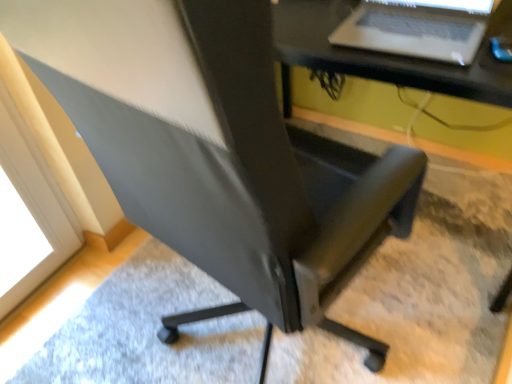
The width and height of the screenshot is (512, 384). Identify the location of silver metallic laptop at upper right. (417, 28).

Describe the element at coordinates (417, 28) in the screenshot. This screenshot has height=384, width=512. I see `silver metallic laptop at upper right` at that location.

Identify the location of black plastic computer desk at center. The image size is (512, 384). (366, 57).

Image resolution: width=512 pixels, height=384 pixels. Describe the element at coordinates (366, 57) in the screenshot. I see `black plastic computer desk at center` at that location.

At what (x,y) coordinates should I click in order to perform the action: click on silver metallic laptop at upper right. Please return your answer as a coordinate pair (x, y). Looking at the image, I should click on 417,28.

Can you confirm if silver metallic laptop at upper right is positioned to the left of black plastic computer desk at center?

Correct, you'll find silver metallic laptop at upper right to the left of black plastic computer desk at center.

Considering the relative positions of silver metallic laptop at upper right and black plastic computer desk at center in the image provided, is silver metallic laptop at upper right in front of black plastic computer desk at center?

No.

Considering the points (354, 19) and (293, 35), which point is in front, point (354, 19) or point (293, 35)?

The point (293, 35) is more forward.

From the image's perspective, who appears lower, silver metallic laptop at upper right or black plastic computer desk at center?

black plastic computer desk at center, from the image's perspective.

From a real-world perspective, which object stands above the other?

silver metallic laptop at upper right, from a real-world perspective.

Considering the relative sizes of silver metallic laptop at upper right and black plastic computer desk at center in the image provided, is silver metallic laptop at upper right wider than black plastic computer desk at center?

No, silver metallic laptop at upper right is not wider than black plastic computer desk at center.

Considering the sizes of objects silver metallic laptop at upper right and black plastic computer desk at center in the image provided, who is shorter, silver metallic laptop at upper right or black plastic computer desk at center?

Standing shorter between the two is silver metallic laptop at upper right.

Is silver metallic laptop at upper right smaller than black plastic computer desk at center?

Correct, silver metallic laptop at upper right occupies less space than black plastic computer desk at center.

Looking at this image, is silver metallic laptop at upper right inside or outside of black plastic computer desk at center?

silver metallic laptop at upper right is inside black plastic computer desk at center.

Are silver metallic laptop at upper right and black plastic computer desk at center beside each other?

They are not placed beside each other.

Looking at this image, is silver metallic laptop at upper right oriented towards black plastic computer desk at center?

No, silver metallic laptop at upper right is not oriented towards black plastic computer desk at center.

Can you tell me how much silver metallic laptop at upper right and black plastic computer desk at center differ in facing direction?

The angle between the facing direction of silver metallic laptop at upper right and the facing direction of black plastic computer desk at center is 2.52 degrees.

This screenshot has width=512, height=384. Find the location of `laptop above the black plastic computer desk at center (from the image's perspective)`. laptop above the black plastic computer desk at center (from the image's perspective) is located at coordinates (417, 28).

Between black plastic computer desk at center and silver metallic laptop at upper right, which one appears on the right side from the viewer's perspective?

From the viewer's perspective, black plastic computer desk at center appears more on the right side.

Which object is closer to the camera taking this photo, black plastic computer desk at center or silver metallic laptop at upper right?

black plastic computer desk at center.

Which is more distant, (445, 78) or (435, 50)?

The point (435, 50) is farther from the camera.

From the image's perspective, is black plastic computer desk at center located above silver metallic laptop at upper right?

Actually, black plastic computer desk at center appears below silver metallic laptop at upper right in the image.

From a real-world perspective, which object stands above the other?

silver metallic laptop at upper right.

Does black plastic computer desk at center have a lesser width compared to silver metallic laptop at upper right?

No.

In terms of height, does black plastic computer desk at center look taller or shorter compared to silver metallic laptop at upper right?

In the image, black plastic computer desk at center appears to be taller than silver metallic laptop at upper right.

Is black plastic computer desk at center bigger than silver metallic laptop at upper right?

Yes.

Would you say black plastic computer desk at center is outside silver metallic laptop at upper right?

Yes, black plastic computer desk at center is located beyond the bounds of silver metallic laptop at upper right.

Is black plastic computer desk at center next to silver metallic laptop at upper right?

black plastic computer desk at center is not next to silver metallic laptop at upper right, and they're not touching.

Is black plastic computer desk at center looking in the opposite direction of silver metallic laptop at upper right?

black plastic computer desk at center is not turned away from silver metallic laptop at upper right.

What's the angular difference between black plastic computer desk at center and silver metallic laptop at upper right's facing directions?

The angular difference between black plastic computer desk at center and silver metallic laptop at upper right is 2.52 degrees.

I want to click on computer desk located underneath the silver metallic laptop at upper right (from a real-world perspective), so click(366, 57).

Find the location of a particular element. This screenshot has height=384, width=512. computer desk below the silver metallic laptop at upper right (from a real-world perspective) is located at coordinates (366, 57).

Locate an element on the screen. computer desk in front of the silver metallic laptop at upper right is located at coordinates (366, 57).